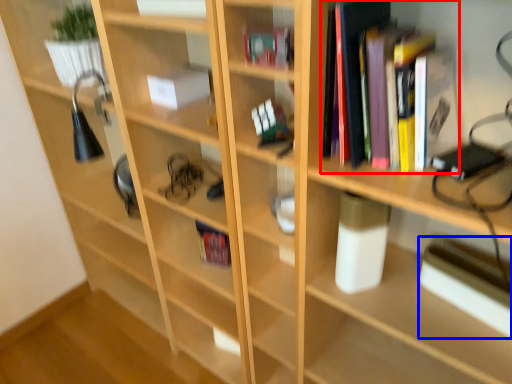
Question: Which object is further to the camera taking this photo, book (highlighted by a red box) or paperback book (highlighted by a blue box)?

Choices:
 (A) book
 (B) paperback book

Answer: (B)